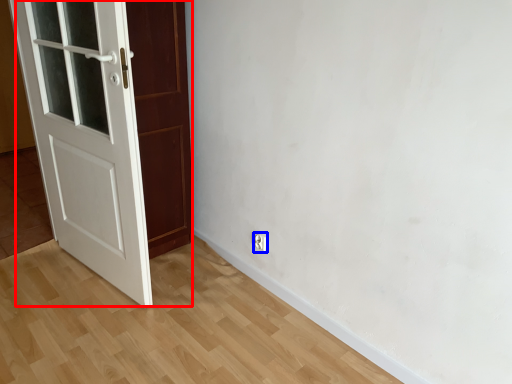
Question: Which object is closer to the camera taking this photo, door (highlighted by a red box) or electric outlet (highlighted by a blue box)?

Choices:
 (A) door
 (B) electric outlet

Answer: (A)